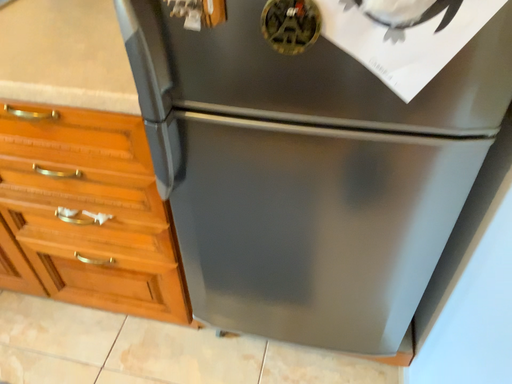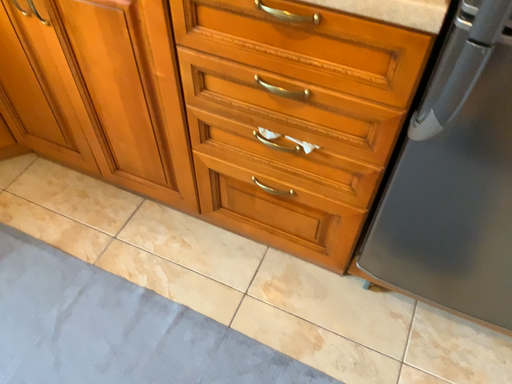
Question: Which way did the camera rotate in the video?

Choices:
 (A) rotated downward
 (B) rotated upward

Answer: (A)